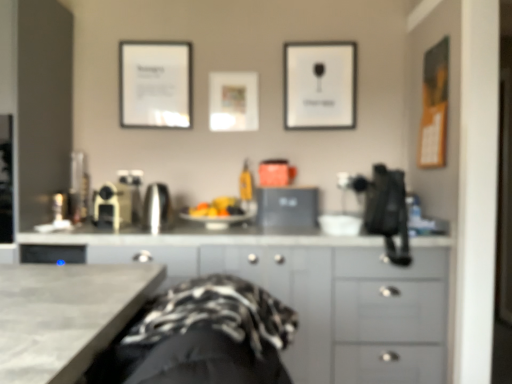
Question: From the image's perspective, is white paper picture frame at upper center, the first picture frame from the right, located above or below matte white picture frame at center, which is the 2th picture frame from left to right?

Choices:
 (A) above
 (B) below

Answer: (A)

Question: From a real-world perspective, relative to matte white picture frame at center, which is the 2th picture frame from left to right, is white paper picture frame at upper center, the first picture frame from the right, vertically above or below?

Choices:
 (A) above
 (B) below

Answer: (A)

Question: Which object is positioned farthest from the gray matte cabinet at center?

Choices:
 (A) satin gold coffee maker at center, which is the third appliance from right to left
 (B) white paper picture frame at upper center, the first picture frame from the right
 (C) satin black laptop at center, which appears as the third appliance when viewed from the left
 (D) matte white picture frame at center, marked as the 2th picture frame in a right-to-left arrangement
 (E) satin silver kettle at center, the 2th appliance when ordered from left to right

Answer: (D)

Question: Which object is the closest to the white paper at upper left, marked as the third picture frame in a right-to-left arrangement?

Choices:
 (A) white paper picture frame at upper center, which appears as the 3th picture frame when viewed from the left
 (B) satin gold coffee maker at center, which ranks as the first appliance in left-to-right order
 (C) satin silver kettle at center, the 2th appliance when ordered from left to right
 (D) gray matte cabinet at center
 (E) satin black laptop at center, the first appliance in the right-to-left sequence

Answer: (B)